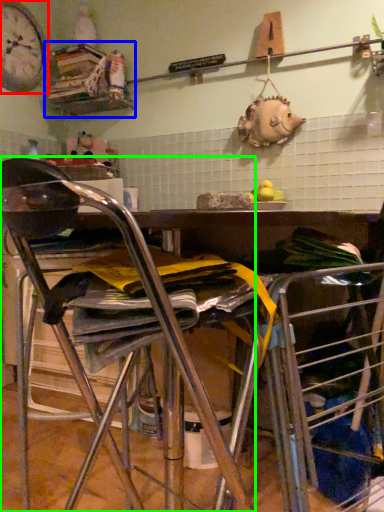
Question: Based on their relative distances, which object is nearer to clock (highlighted by a red box)? Choose from shelf (highlighted by a blue box) and chair (highlighted by a green box).

Choices:
 (A) shelf
 (B) chair

Answer: (A)